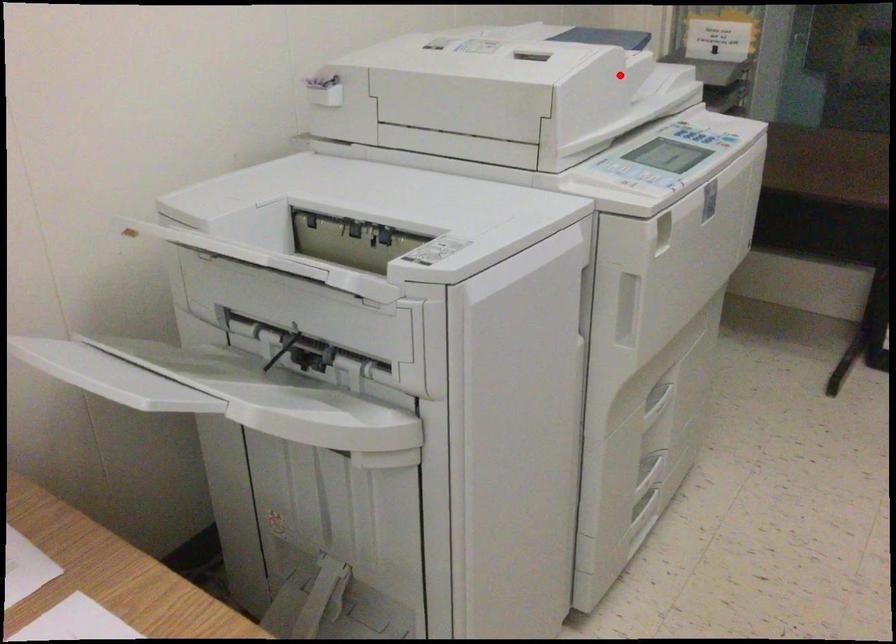
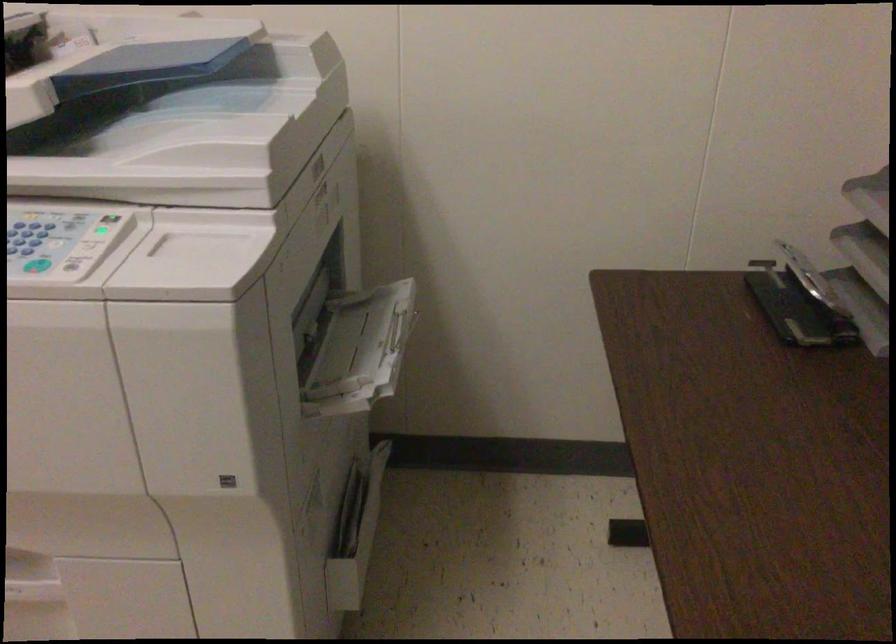
Question: I am providing you with two images of the same scene from different viewpoints. Image1 has a red point marked. In image2, the corresponding 3D location appears at what relative position? Reply with the corresponding letter.

Choices:
 (A) Closer
 (B) Farther

Answer: (A)